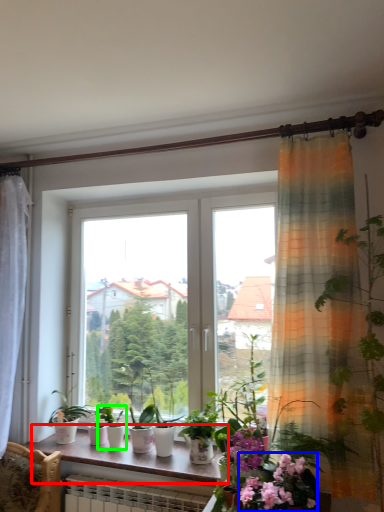
Question: Which is farther away from window sill (highlighted by a red box)? flower (highlighted by a blue box) or houseplant (highlighted by a green box)?

Choices:
 (A) flower
 (B) houseplant

Answer: (A)